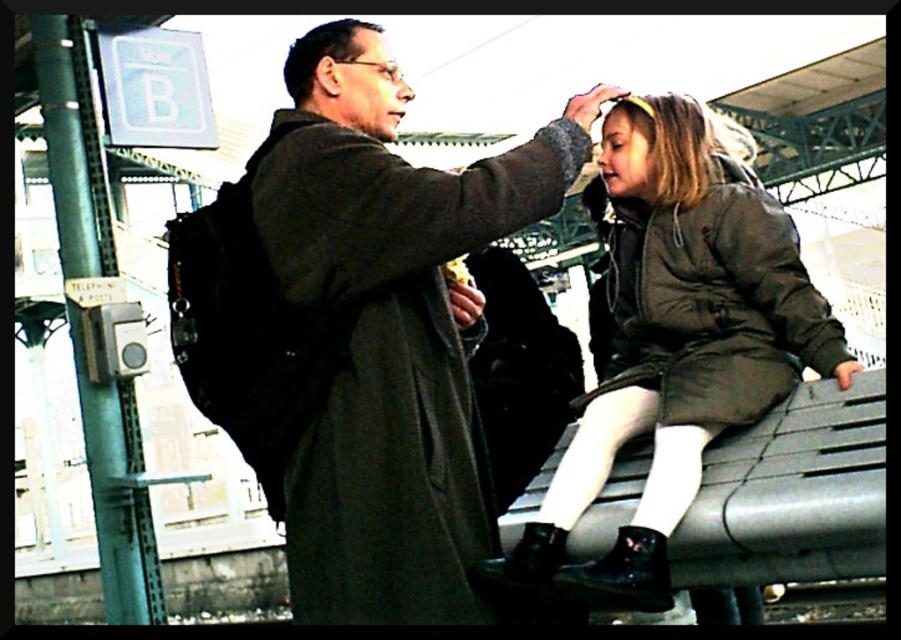
You are a photographer trying to capture a candid shot of two people at the train station. You notice a dark gray coat at center and a matte black coat at center. Which coat is closer to the left side of your frame?

The dark gray coat at center is positioned on the left side of matte black coat at center, so it is closer to the left side of the frame.